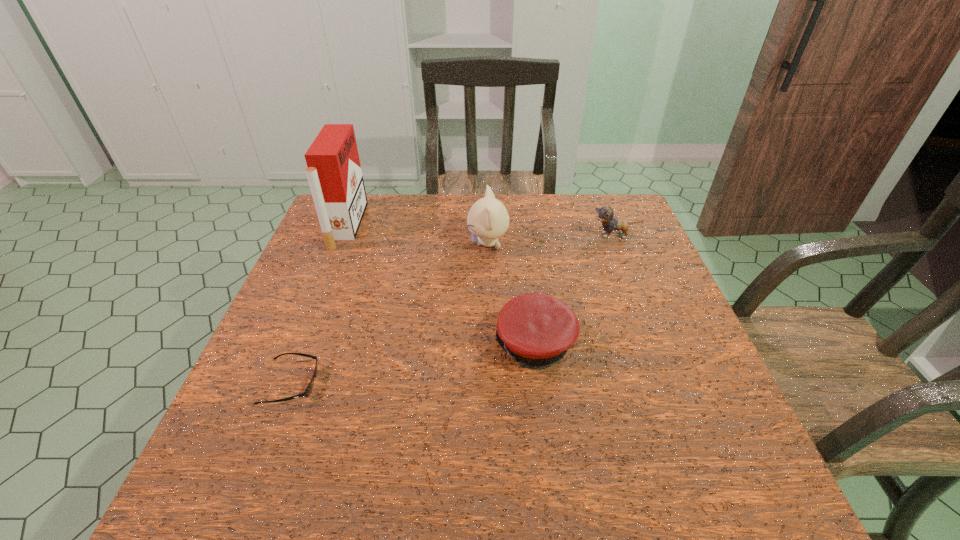
At what (x,y) coordinates should I click in order to perform the action: click on free space at the near right corner of the desktop. Please return your answer as a coordinate pair (x, y). The width and height of the screenshot is (960, 540). Looking at the image, I should click on (674, 474).

Locate an element on the screen. blank region between the second shortest object and the third tallest object is located at coordinates point(575,291).

At what (x,y) coordinates should I click in order to perform the action: click on unoccupied area between the shorter kitten and the fourth tallest object. Please return your answer as a coordinate pair (x, y). This screenshot has height=540, width=960. Looking at the image, I should click on (575, 291).

This screenshot has width=960, height=540. I want to click on vacant area that lies between the shortest object and the shorter kitten, so click(x=453, y=309).

Where is `blank region between the tallest object and the left kitten`? This screenshot has width=960, height=540. blank region between the tallest object and the left kitten is located at coordinates (418, 234).

The height and width of the screenshot is (540, 960). I want to click on unoccupied area between the second shortest object and the cigarette case, so click(441, 285).

Identify the location of empty space that is in between the cigarette case and the left kitten. Image resolution: width=960 pixels, height=540 pixels. (418, 234).

Identify the location of vacant space in between the second shortest object and the third shortest object. (575, 291).

Where is `vacant space that is in between the cigarette case and the taller kitten`? vacant space that is in between the cigarette case and the taller kitten is located at coordinates (418, 234).

Where is `vacant space in between the cigarette case and the shortest object`? vacant space in between the cigarette case and the shortest object is located at coordinates (319, 305).